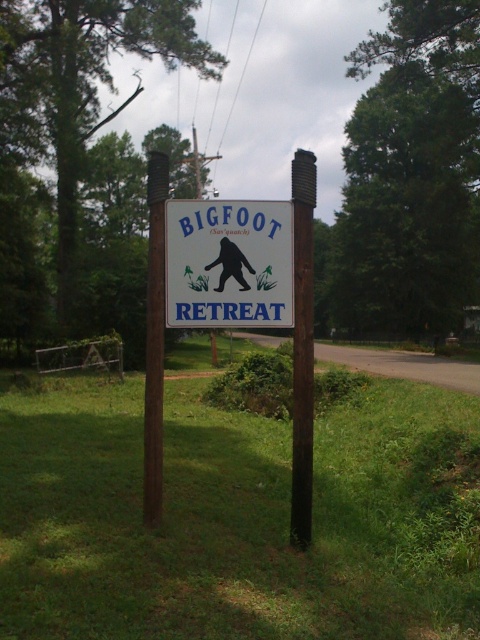
Question: Considering the relative positions of brown wood post at center and brown wooden post at center in the image provided, where is brown wood post at center located with respect to brown wooden post at center?

Choices:
 (A) below
 (B) above

Answer: (A)

Question: Which of the following is the farthest from the observer?

Choices:
 (A) brown wooden post at center
 (B) brown wood post at center

Answer: (B)

Question: Can you confirm if blue plastic sign at center is smaller than brown wooden post at center?

Choices:
 (A) yes
 (B) no

Answer: (A)

Question: Which object appears farthest from the camera in this image?

Choices:
 (A) brown wooden post at center
 (B) blue plastic sign at center
 (C) brown wood post at center

Answer: (C)

Question: Is blue plastic sign at center smaller than brown wooden post at center?

Choices:
 (A) yes
 (B) no

Answer: (A)

Question: Which point appears closest to the camera in this image?

Choices:
 (A) (292, 291)
 (B) (304, 230)

Answer: (B)